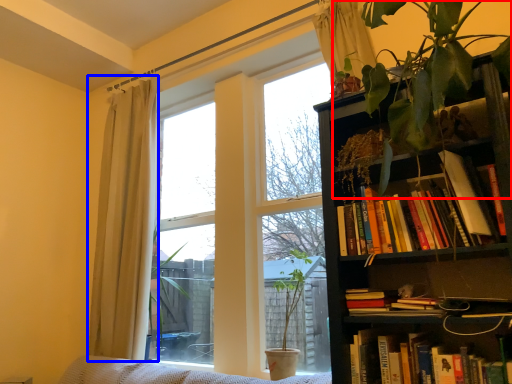
Question: Which point is further to the camera, vegetation (highlighted by a red box) or curtain (highlighted by a blue box)?

Choices:
 (A) vegetation
 (B) curtain

Answer: (B)